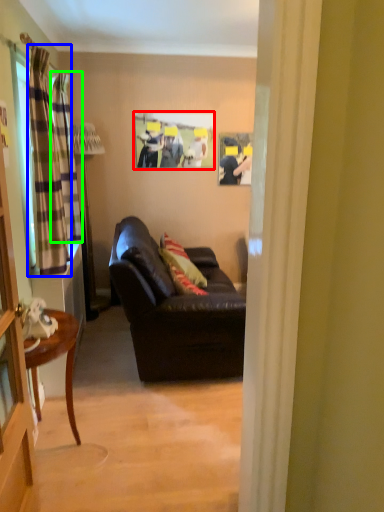
Question: Considering the real-world distances, which object is farthest from picture frame (highlighted by a red box)? curtain (highlighted by a blue box) or curtain (highlighted by a green box)?

Choices:
 (A) curtain
 (B) curtain

Answer: (A)